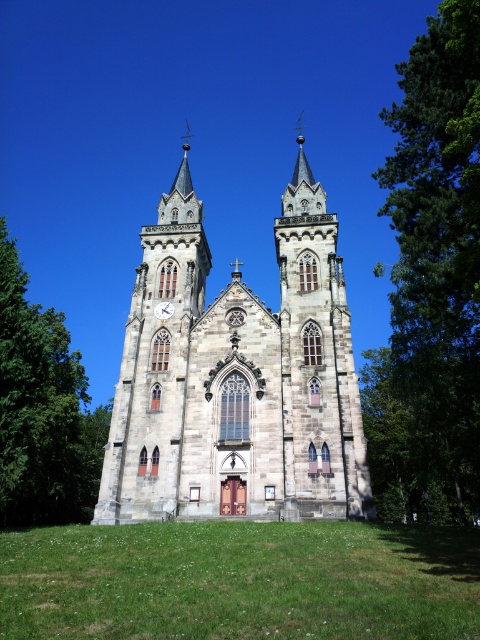
You are standing at point A, which is located at coordinates [237,378]. What is the object located exactly at this point?

The object located at point A, coordinates [237,378] is the brown stone church at center.

You are standing at the center of a square in front of the brown stone church at center. If you walk straight ahead, will you hit the church immediately?

The brown stone church at center is positioned at point (237, 378), which means it is slightly offset from the exact center of the square. Therefore, walking straight ahead from the center of the square might not lead you directly to the church, so you might not hit it immediately.

You are standing in front of the brown stone church at center and the white matte clock at center. Which one do you see taller?

The brown stone church at center is taller than the white matte clock at center.